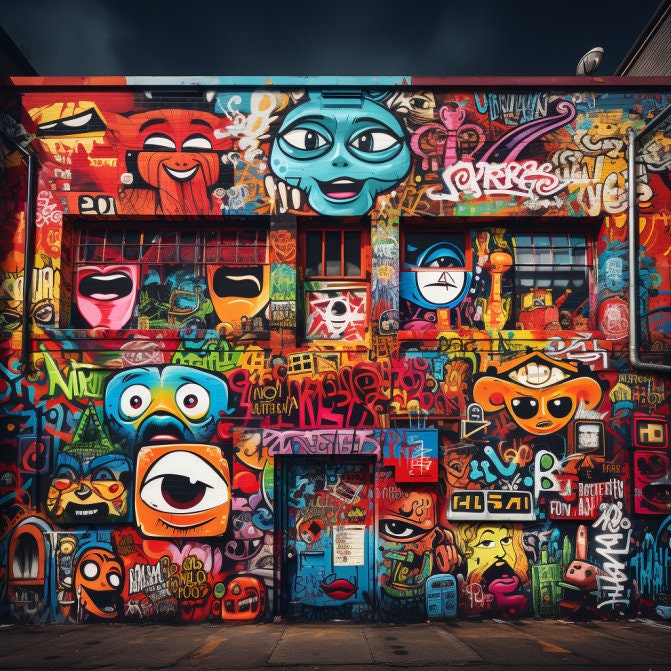
Locate an element on the screen. This screenshot has height=671, width=671. window is located at coordinates (333, 260).